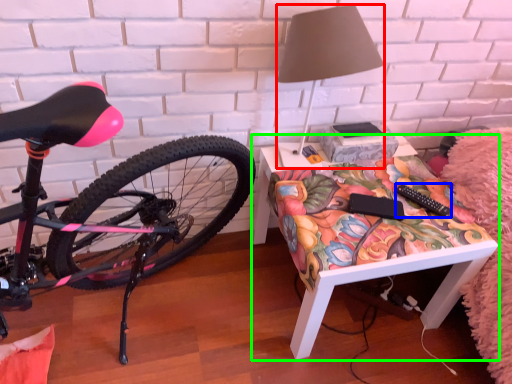
Question: Which object is the farthest from lamp (highlighted by a red box)? Choose among these: remote control (highlighted by a blue box) or desk (highlighted by a green box).

Choices:
 (A) remote control
 (B) desk

Answer: (B)